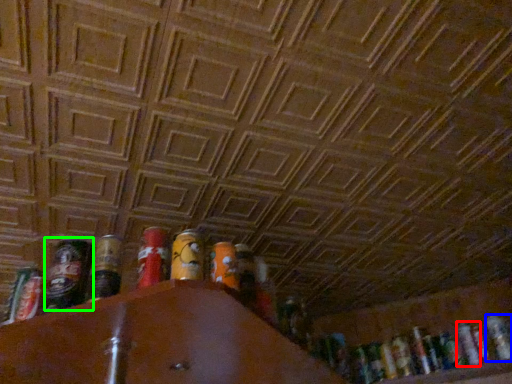
Question: Which object is the closest to the beer (highlighted by a red box)? Choose among these: beer (highlighted by a blue box) or beer (highlighted by a green box).

Choices:
 (A) beer
 (B) beer

Answer: (A)